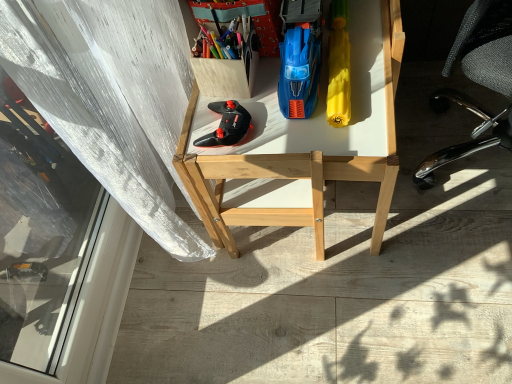
You are a GUI agent. You are given a task and a screenshot of the screen. Output one action in this format:
    pyautogui.click(x=<x>, y=<y>)
    Task: Click on the free spot in front of yellow matte umbrella at right, the fourth stationery from the left
    This screenshot has height=384, width=512.
    Given the screenshot: What is the action you would take?
    pyautogui.click(x=351, y=109)